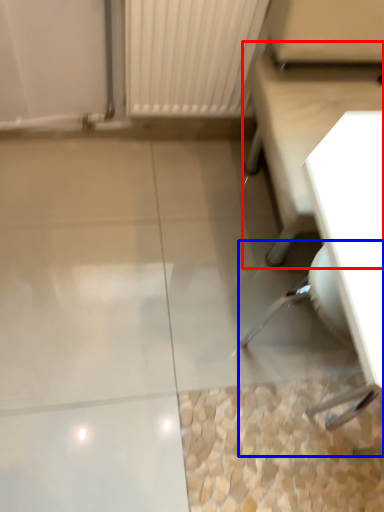
Question: Which object appears farthest to the camera in this image, furniture (highlighted by a red box) or swivel chair (highlighted by a blue box)?

Choices:
 (A) furniture
 (B) swivel chair

Answer: (B)